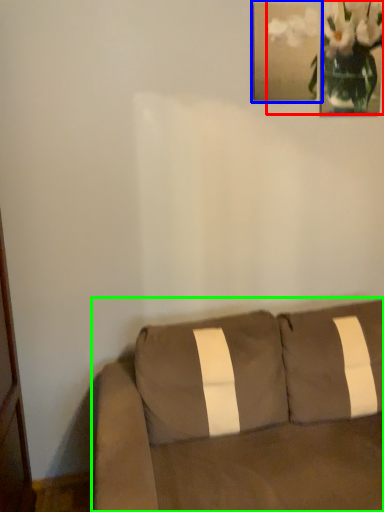
Question: Considering the real-world distances, which object is closest to floral arrangement (highlighted by a red box)? picture frame (highlighted by a blue box) or studio couch (highlighted by a green box).

Choices:
 (A) picture frame
 (B) studio couch

Answer: (A)